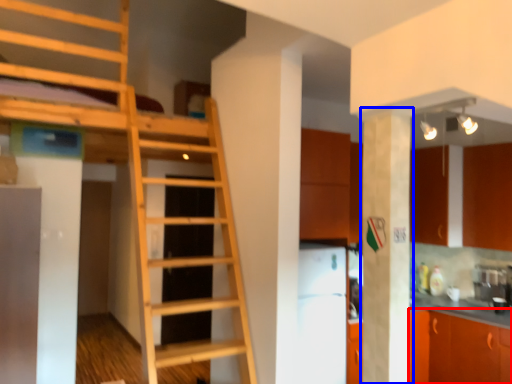
Question: Which of the following is the closest to the observer, cabinetry (highlighted by a red box) or pillar (highlighted by a blue box)?

Choices:
 (A) cabinetry
 (B) pillar

Answer: (B)